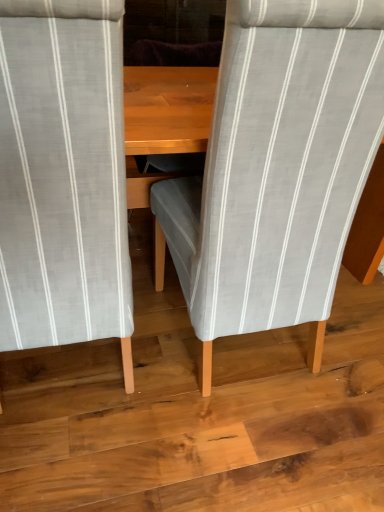
This screenshot has height=512, width=384. I want to click on free point below light gray striped fabric chair at center, the first chair positioned from the right (from a real-world perspective), so click(230, 349).